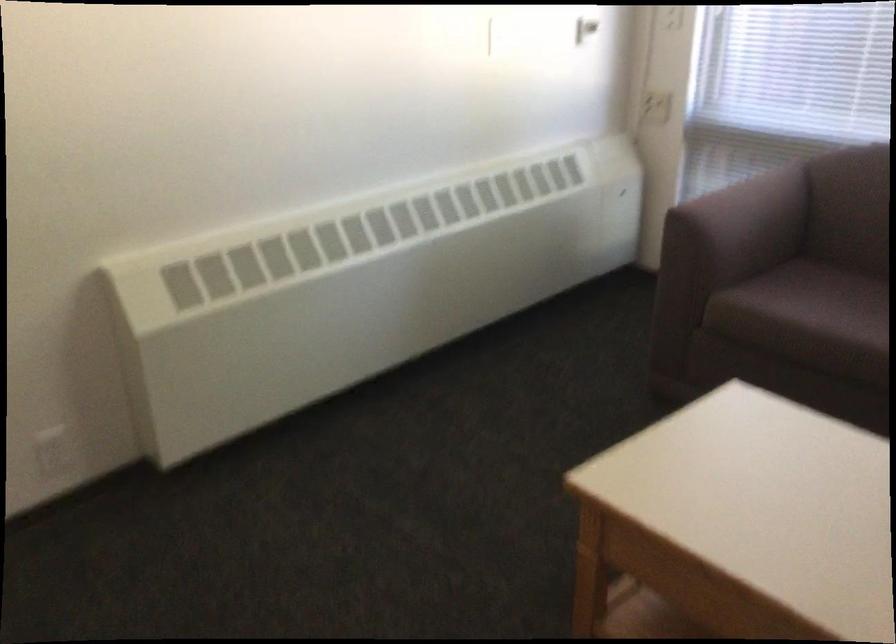
Find where to push the white light switch. Please return your answer as a coordinate pair (x, y).

(656, 107)